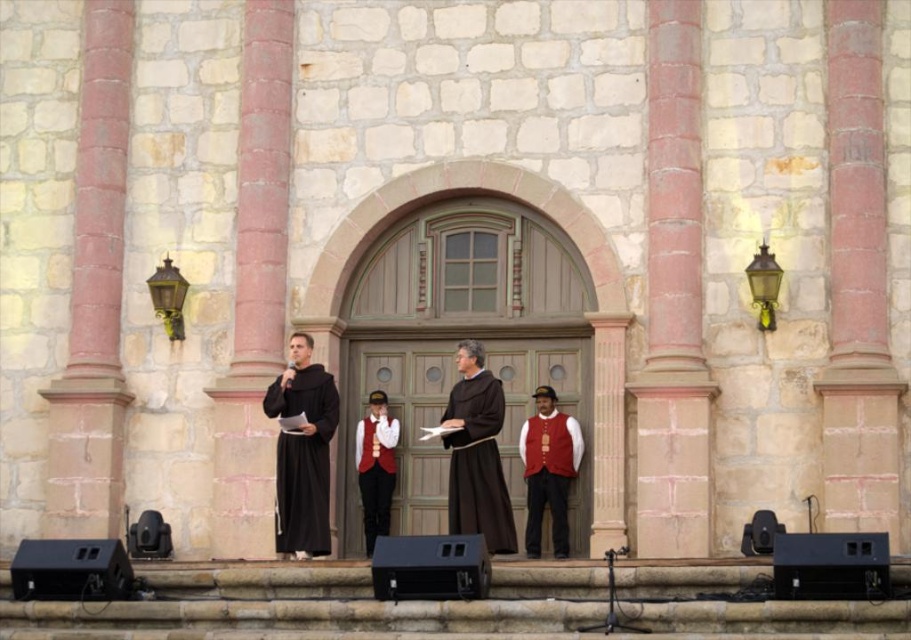
You are standing in front of the stone building with the arched doorway. There are two points marked on the ground. The first point is at coordinates point (474,380) and the second point is at point (382,512). Which point is closer to the entrance of the building?

Point (474,380) is in front of point (382,512), so it is closer to the entrance of the building.